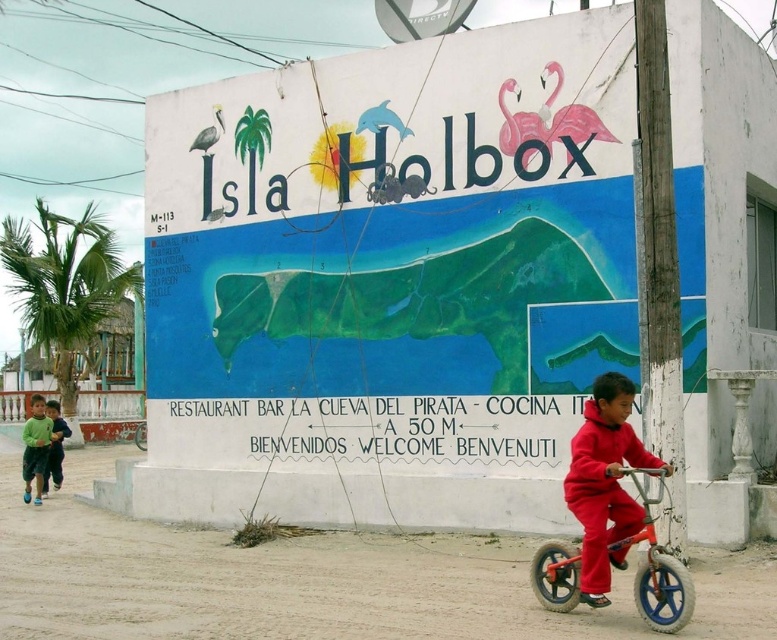
You are standing in front of the wall where the white painted sign at center and the green fleece jacket at lower left are located. Which object is positioned higher up on the wall?

The white painted sign at center is positioned higher up on the wall than the green fleece jacket at lower left because it is above it.

You are a tour guide preparing to carry both the orange matte monocycle at lower right and the green fleece jacket at lower left. Based on their sizes, which item should you carry first to ensure you can fit both into your backpack?

The orange matte monocycle at lower right might be wider than the green fleece jacket at lower left, so you should carry the green fleece jacket at lower left first to ensure there is enough space for the wider monocycle.

You are standing in front of the white painted sign at center and the green fleece jacket at lower left. Which object is closer to you?

The white painted sign at center is closer to you because it is in front of the green fleece jacket at lower left.